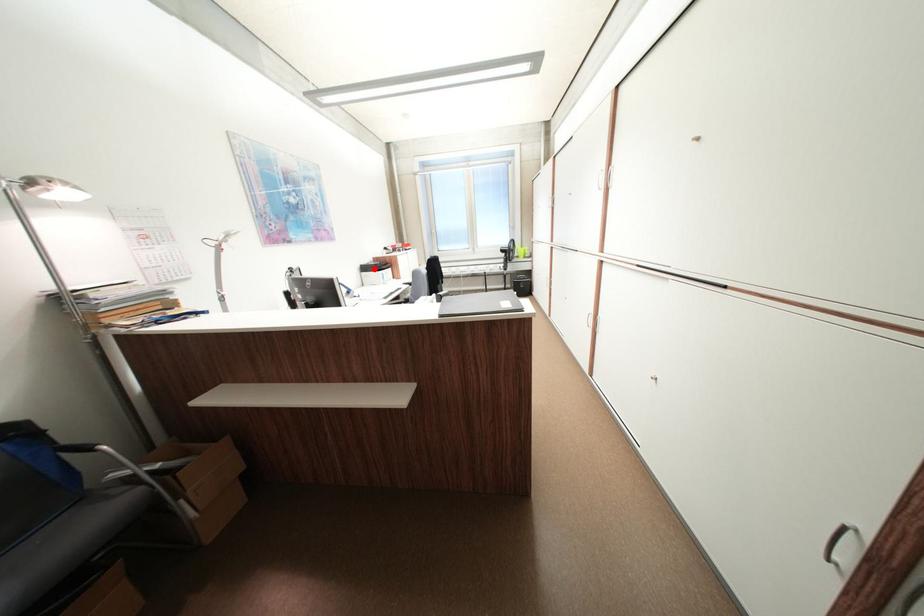
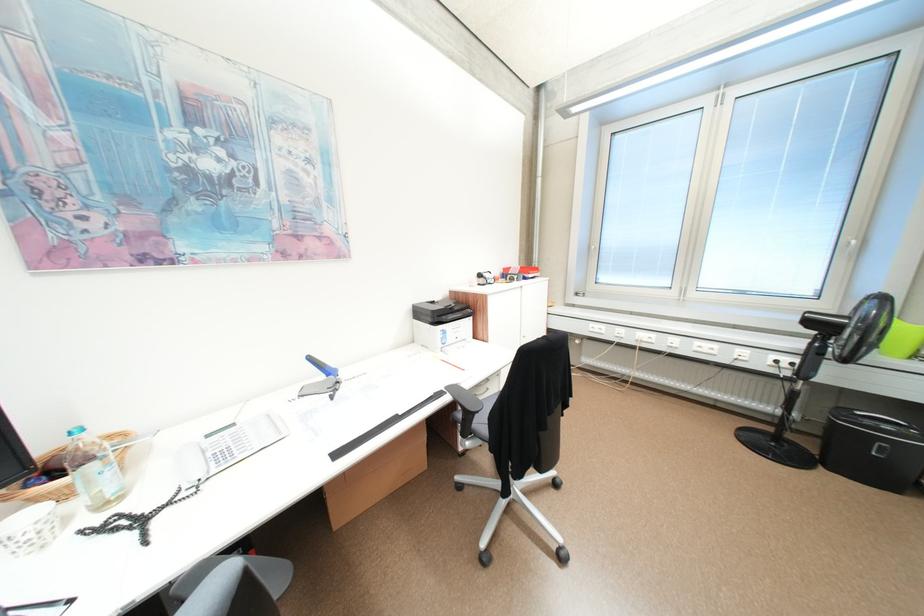
Locate, in the second image, the point that corresponds to the highlighted location in the first image.

(428, 313)